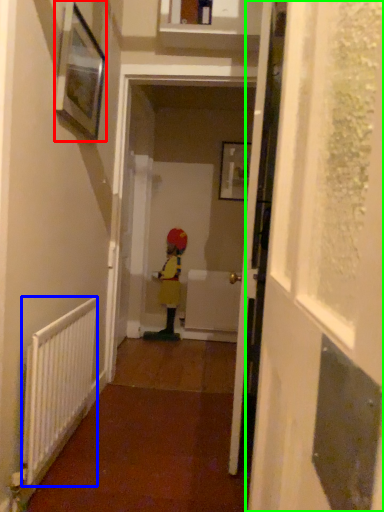
Question: Which object is the farthest from picture frame (highlighted by a red box)? Choose among these: radiator (highlighted by a blue box) or screen door (highlighted by a green box).

Choices:
 (A) radiator
 (B) screen door

Answer: (B)